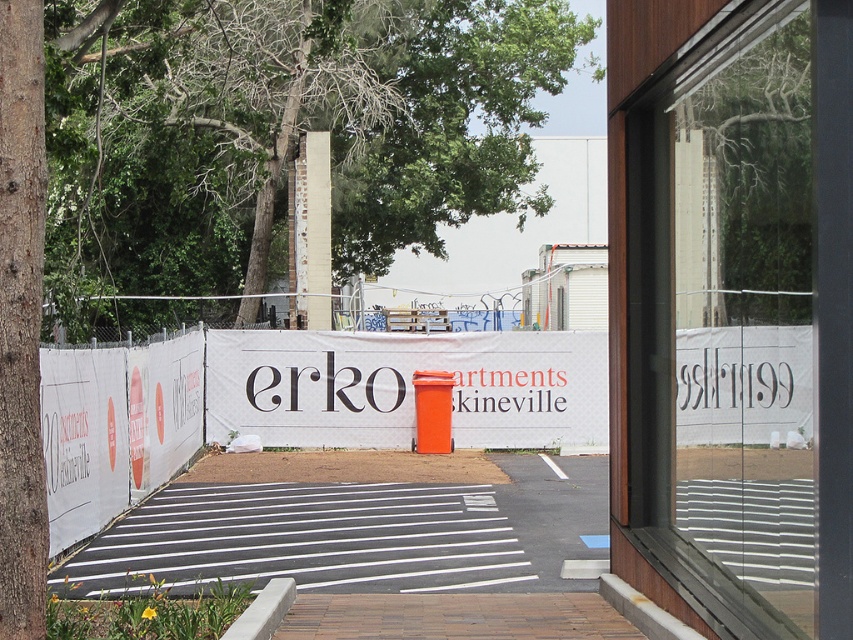
Question: Which object is positioned farthest from the transparent glass window at center?

Choices:
 (A) green leafy tree at upper left
 (B) white fabric banner at center

Answer: (A)

Question: Where is transparent glass window at center located in relation to green leafy tree at upper left in the image?

Choices:
 (A) left
 (B) right

Answer: (B)

Question: Does transparent glass window at center lie behind green leafy tree at upper left?

Choices:
 (A) no
 (B) yes

Answer: (A)

Question: Which object appears closest to the camera in this image?

Choices:
 (A) green leafy tree at upper left
 (B) white fabric banner at center

Answer: (A)

Question: Which object appears farthest from the camera in this image?

Choices:
 (A) green leafy tree at upper left
 (B) transparent glass window at center

Answer: (A)

Question: Is transparent glass window at center bigger than white fabric banner at center?

Choices:
 (A) no
 (B) yes

Answer: (A)